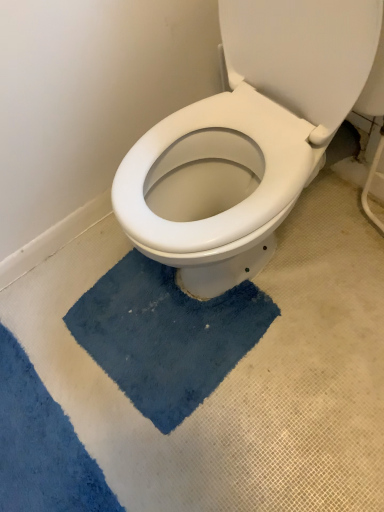
Question: Which direction should I rotate to look at blue plush bath mat at center, which is the second bath mat in left-to-right order?

Choices:
 (A) right
 (B) left

Answer: (B)

Question: Which direction should I rotate to look at blue plush bath mat at lower center, the first bath mat in the left-to-right sequence, — up or down?

Choices:
 (A) up
 (B) down

Answer: (B)

Question: Is blue plush bath mat at lower center, the first bath mat in the left-to-right sequence, looking in the opposite direction of blue plush bath mat at center, acting as the first bath mat starting from the right?

Choices:
 (A) yes
 (B) no

Answer: (A)

Question: From the image's perspective, does blue plush bath mat at lower center, the first bath mat in the left-to-right sequence, appear higher than blue plush bath mat at center, acting as the first bath mat starting from the right?

Choices:
 (A) yes
 (B) no

Answer: (B)

Question: Does blue plush bath mat at lower center, marked as the 2th bath mat in a right-to-left arrangement, have a greater height compared to blue plush bath mat at center, which is the second bath mat in left-to-right order?

Choices:
 (A) no
 (B) yes

Answer: (A)

Question: Considering the relative sizes of blue plush bath mat at lower center, the first bath mat in the left-to-right sequence, and blue plush bath mat at center, which is the second bath mat in left-to-right order, in the image provided, is blue plush bath mat at lower center, the first bath mat in the left-to-right sequence, wider than blue plush bath mat at center, which is the second bath mat in left-to-right order,?

Choices:
 (A) yes
 (B) no

Answer: (B)

Question: From the image's perspective, would you say blue plush bath mat at lower center, the first bath mat in the left-to-right sequence, is shown under blue plush bath mat at center, which is the second bath mat in left-to-right order?

Choices:
 (A) yes
 (B) no

Answer: (A)

Question: Considering the relative sizes of blue plush bath mat at lower center, marked as the 2th bath mat in a right-to-left arrangement, and blue plush bath mat at center, which is the second bath mat in left-to-right order, in the image provided, is blue plush bath mat at lower center, marked as the 2th bath mat in a right-to-left arrangement, shorter than blue plush bath mat at center, which is the second bath mat in left-to-right order,?

Choices:
 (A) yes
 (B) no

Answer: (B)

Question: Is blue plush bath mat at center, acting as the first bath mat starting from the right, next to blue plush bath mat at lower center, the first bath mat in the left-to-right sequence?

Choices:
 (A) yes
 (B) no

Answer: (B)

Question: From a real-world perspective, does blue plush bath mat at center, which is the second bath mat in left-to-right order, stand above blue plush bath mat at lower center, marked as the 2th bath mat in a right-to-left arrangement?

Choices:
 (A) no
 (B) yes

Answer: (A)

Question: Is blue plush bath mat at center, acting as the first bath mat starting from the right, taller than blue plush bath mat at lower center, the first bath mat in the left-to-right sequence?

Choices:
 (A) yes
 (B) no

Answer: (B)

Question: From a real-world perspective, is blue plush bath mat at center, acting as the first bath mat starting from the right, beneath blue plush bath mat at lower center, marked as the 2th bath mat in a right-to-left arrangement?

Choices:
 (A) yes
 (B) no

Answer: (A)

Question: From the image's perspective, would you say blue plush bath mat at center, acting as the first bath mat starting from the right, is shown under blue plush bath mat at lower center, the first bath mat in the left-to-right sequence?

Choices:
 (A) yes
 (B) no

Answer: (B)

Question: Can you confirm if blue plush bath mat at center, acting as the first bath mat starting from the right, is positioned to the left of blue plush bath mat at lower center, the first bath mat in the left-to-right sequence?

Choices:
 (A) yes
 (B) no

Answer: (B)

Question: Is blue plush bath mat at center, acting as the first bath mat starting from the right, to the left or to the right of blue plush bath mat at lower center, marked as the 2th bath mat in a right-to-left arrangement, in the image?

Choices:
 (A) left
 (B) right

Answer: (B)